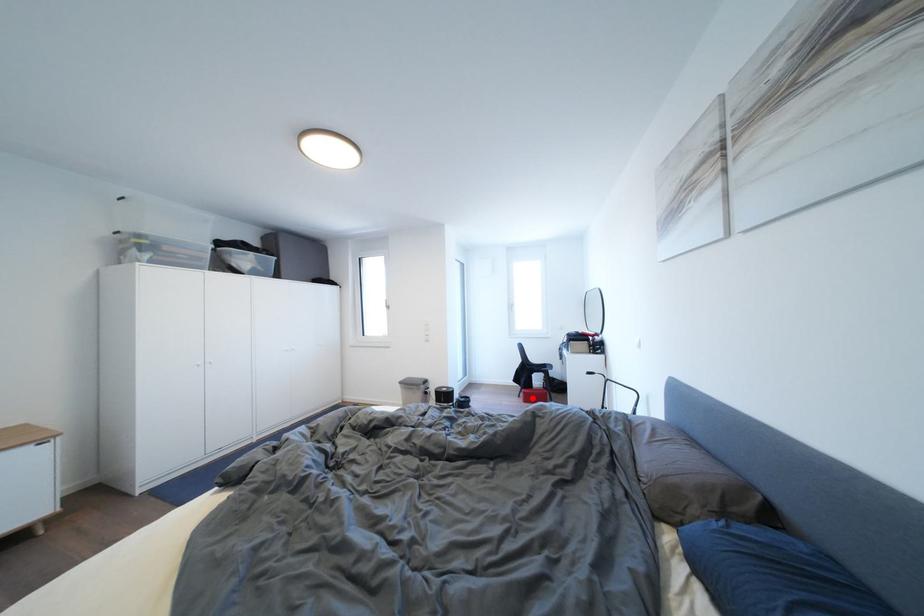
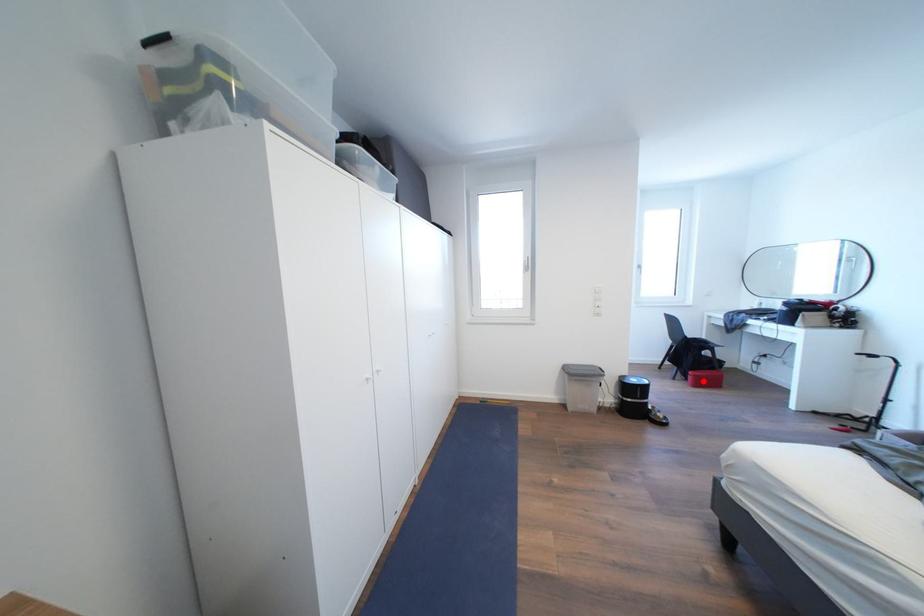
I am providing you with two images of the same scene from different viewpoints. A red point is marked on the first image and another point is marked on the second image. Are the points marked in image1 and image2 representing the same 3D position?

Yes